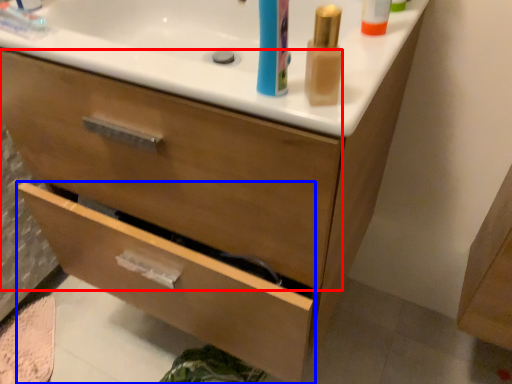
Question: Among these objects, which one is farthest to the camera, drawer (highlighted by a red box) or drawer (highlighted by a blue box)?

Choices:
 (A) drawer
 (B) drawer

Answer: (B)